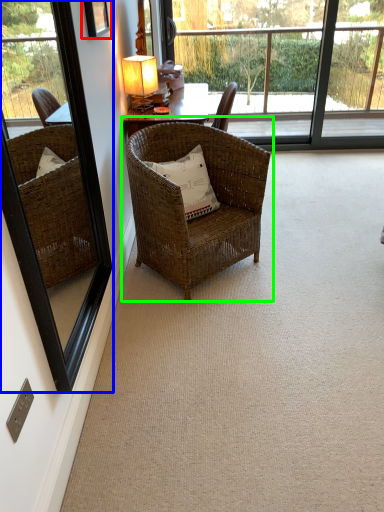
Question: Considering the real-world distances, which object is closest to picture frame (highlighted by a red box)? window frame (highlighted by a blue box) or chair (highlighted by a green box).

Choices:
 (A) window frame
 (B) chair

Answer: (A)